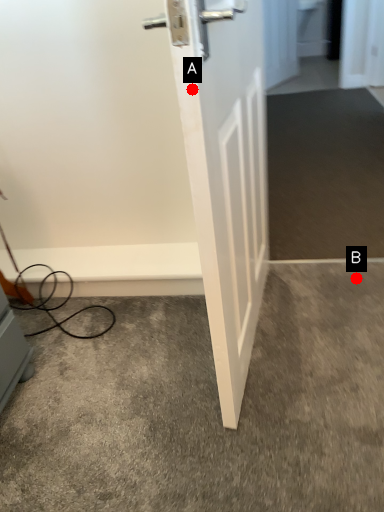
Question: Two points are circled on the image, labeled by A and B beside each circle. Which point is closer to the camera?

Choices:
 (A) A is closer
 (B) B is closer

Answer: (A)